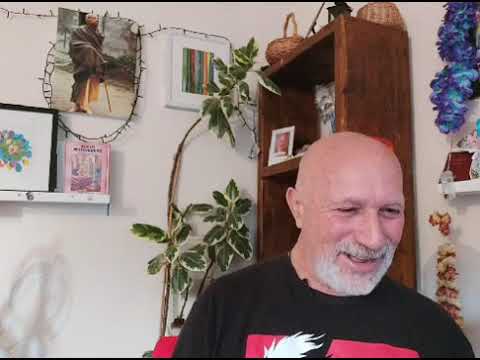
At what (x,y) coordinates should I click in order to perform the action: click on cabinet. Please return your answer as a coordinate pair (x, y). This screenshot has height=360, width=480. Looking at the image, I should click on (373, 77).